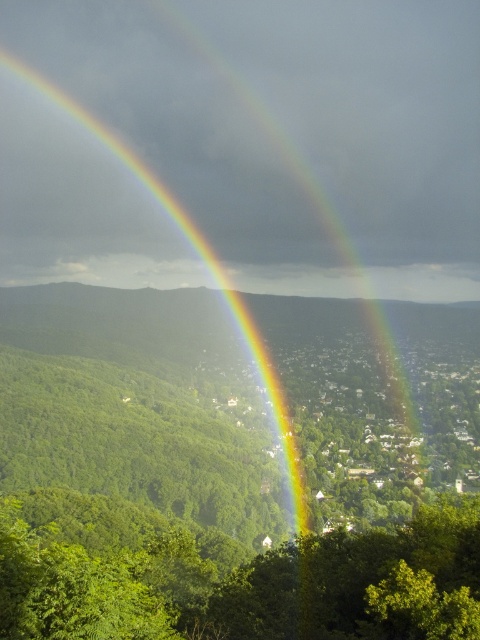
Question: Among these objects, which one is nearest to the camera?

Choices:
 (A) green leafy tree at center
 (B) rainbow at center

Answer: (A)

Question: Which point appears farthest from the camera in this image?

Choices:
 (A) (126, 584)
 (B) (267, 355)

Answer: (B)

Question: Is green leafy tree at center positioned in front of rainbow at center?

Choices:
 (A) no
 (B) yes

Answer: (B)

Question: Does green leafy tree at center have a lesser width compared to rainbow at center?

Choices:
 (A) no
 (B) yes

Answer: (A)

Question: Is green leafy tree at center positioned behind rainbow at center?

Choices:
 (A) no
 (B) yes

Answer: (A)

Question: Among these points, which one is nearest to the camera?

Choices:
 (A) (263, 353)
 (B) (466, 540)

Answer: (B)